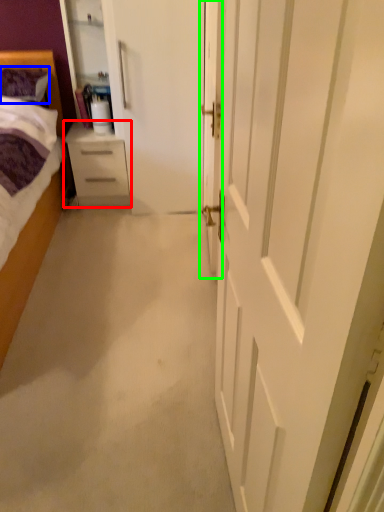
Question: Considering the real-world distances, which object is closest to chest of drawers (highlighted by a red box)? pillow (highlighted by a blue box) or door (highlighted by a green box).

Choices:
 (A) pillow
 (B) door

Answer: (A)